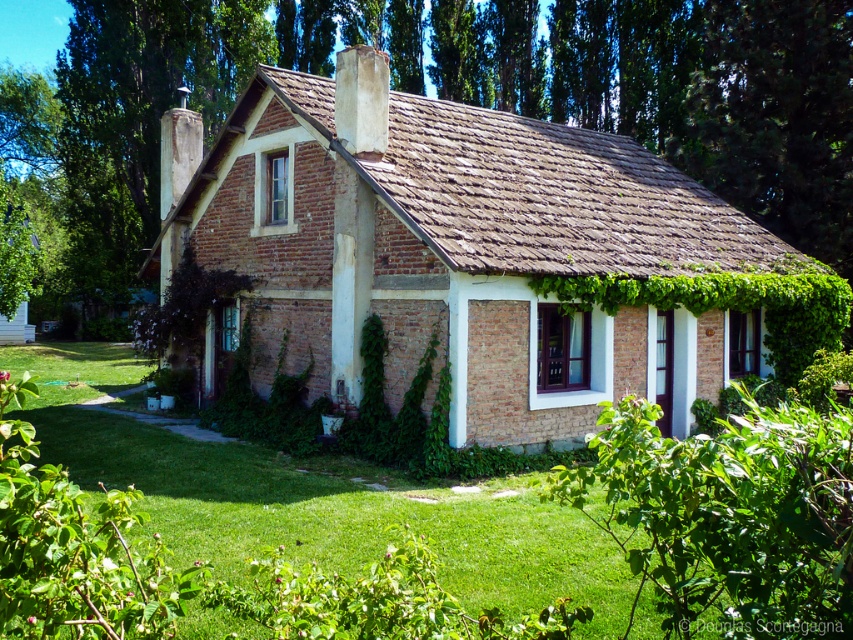
Question: Which object appears closest to the camera in this image?

Choices:
 (A) green grass at center
 (B) brown brick cottage at center
 (C) green leafy hedge at lower right

Answer: (C)

Question: Can you confirm if brown brick cottage at center is positioned to the right of green leafy hedge at lower right?

Choices:
 (A) no
 (B) yes

Answer: (A)

Question: Can you confirm if brown brick cottage at center is bigger than green leafy hedge at lower right?

Choices:
 (A) yes
 (B) no

Answer: (A)

Question: Which object appears farthest from the camera in this image?

Choices:
 (A) brown brick cottage at center
 (B) green grass at center
 (C) green leafy hedge at lower right

Answer: (A)

Question: Which object appears closest to the camera in this image?

Choices:
 (A) green leafy hedge at lower right
 (B) green grass at center
 (C) brown brick cottage at center

Answer: (A)

Question: Where is brown brick cottage at center located in relation to green grass at center in the image?

Choices:
 (A) above
 (B) below

Answer: (A)